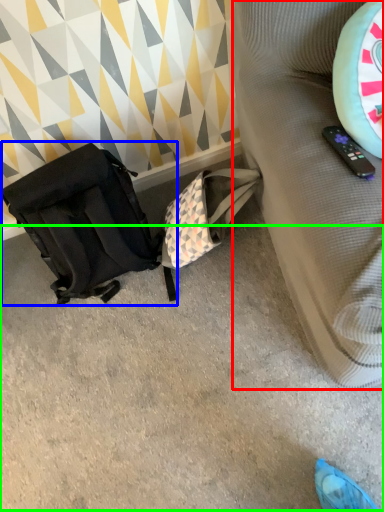
Question: Which object is the closest to the furniture (highlighted by a red box)? Choose among these: luggage and bags (highlighted by a blue box) or concrete (highlighted by a green box).

Choices:
 (A) luggage and bags
 (B) concrete

Answer: (B)